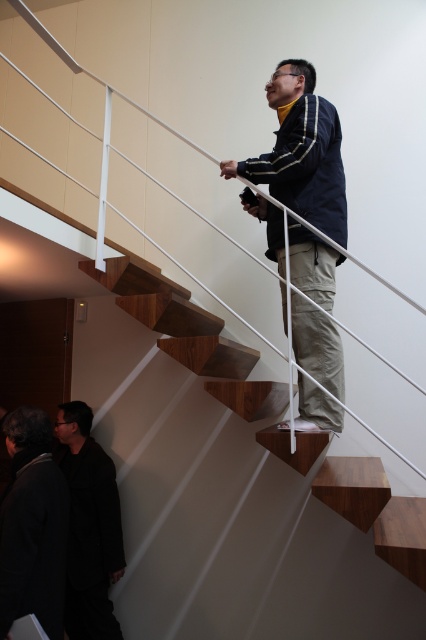
Question: Is dark gray jacket at lower left positioned in front of black fabric suit at lower left?

Choices:
 (A) no
 (B) yes

Answer: (B)

Question: Which point is farther to the camera?

Choices:
 (A) (311, 324)
 (B) (241, 388)
 (C) (63, 460)
 (D) (31, 467)

Answer: (C)

Question: Does wooden stairs at upper center come in front of dark gray jacket at lower left?

Choices:
 (A) yes
 (B) no

Answer: (A)

Question: Which object appears farthest from the camera in this image?

Choices:
 (A) black fabric suit at lower left
 (B) matte black jacket at upper center
 (C) dark gray jacket at lower left

Answer: (A)

Question: Which point appears farthest from the camera in this image?

Choices:
 (A) (184, 352)
 (B) (2, 554)
 (C) (114, 627)
 (D) (305, 234)

Answer: (C)

Question: Is dark gray jacket at lower left to the left of black fabric suit at lower left from the viewer's perspective?

Choices:
 (A) yes
 (B) no

Answer: (A)